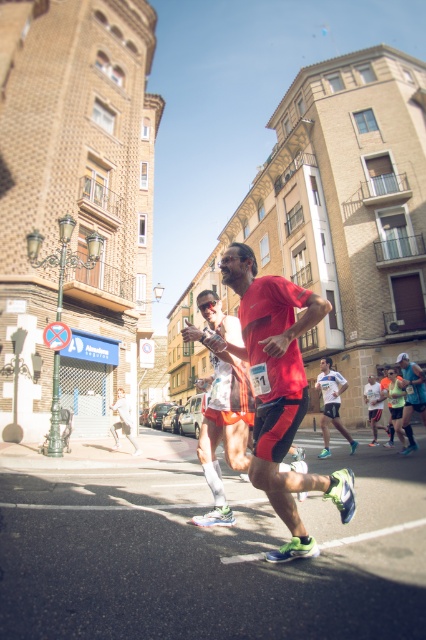
Can you confirm if matte white tank top at center is bigger than matte red shorts at center?

Actually, matte white tank top at center might be smaller than matte red shorts at center.

Is matte white tank top at center closer to the viewer compared to matte red shorts at center?

Yes.

Is point (244, 448) farther from viewer compared to point (411, 408)?

No, it is in front of (411, 408).

Identify the location of matte white tank top at center. (224, 429).

Is matte red shirt at center shorter than white matte running shirt at center?

No, matte red shirt at center is not shorter than white matte running shirt at center.

Can you confirm if matte red shirt at center is positioned to the left of white matte running shirt at center?

Yes, matte red shirt at center is to the left of white matte running shirt at center.

Which is behind, point (282, 285) or point (342, 387)?

Point (342, 387)

Identify the location of matte red shirt at center. The height and width of the screenshot is (640, 426). (279, 390).

Between matte white tank top at center and white matte running shirt at center, which one is positioned higher?

Positioned higher is matte white tank top at center.

Can you confirm if matte white tank top at center is smaller than white matte running shirt at center?

Yes, matte white tank top at center is smaller than white matte running shirt at center.

Is point (226, 458) behind point (333, 390)?

That is False.

Identify the location of matte white tank top at center. [224, 429].